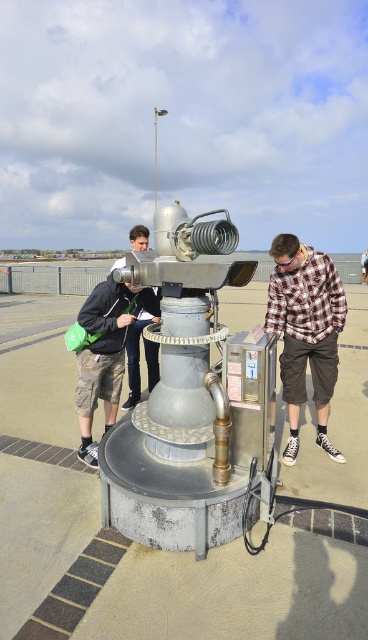
Is plaid shirt at center shorter than matte black jacket at left?

In fact, plaid shirt at center may be taller than matte black jacket at left.

Is plaid shirt at center to the left of matte black jacket at left from the viewer's perspective?

Incorrect, plaid shirt at center is not on the left side of matte black jacket at left.

Describe the element at coordinates (306, 332) in the screenshot. I see `plaid shirt at center` at that location.

At what (x,y) coordinates should I click in order to perform the action: click on plaid shirt at center. Please return your answer as a coordinate pair (x, y). Looking at the image, I should click on (306, 332).

The image size is (368, 640). Describe the element at coordinates (306, 332) in the screenshot. I see `plaid shirt at center` at that location.

Is plaid shirt at center in front of matte black jacket at center?

Yes.

You are a GUI agent. You are given a task and a screenshot of the screen. Output one action in this format:
    pyautogui.click(x=<x>, y=<y>)
    Task: Click on the plaid shirt at center
    
    Given the screenshot: What is the action you would take?
    pyautogui.click(x=306, y=332)

Where is `plaid shirt at center`? Image resolution: width=368 pixels, height=640 pixels. plaid shirt at center is located at coordinates (306, 332).

Who is more forward, [83,308] or [150,388]?

Point [83,308]

Does matte black jacket at center appear on the right side of matte black jacket at left?

Incorrect, matte black jacket at center is not on the right side of matte black jacket at left.

Is point (93, 365) positioned after point (144, 241)?

That is False.

Locate an element on the screen. matte black jacket at center is located at coordinates (104, 353).